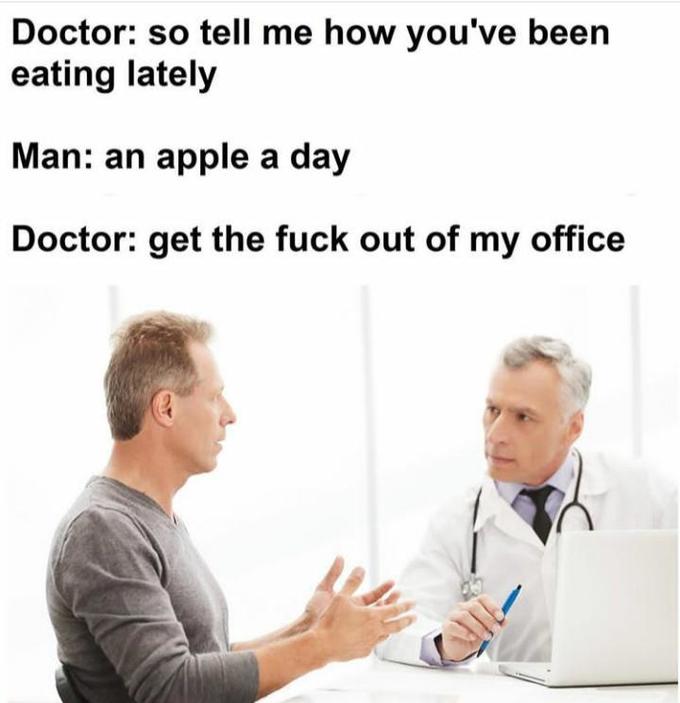
This screenshot has height=703, width=680. I want to click on coat, so click(488, 529).